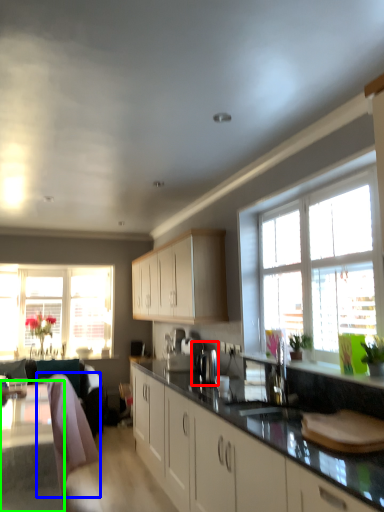
Question: Based on their relative distances, which object is nearer to coffee machine (highlighted by a red box)? Choose from swivel chair (highlighted by a blue box) and table (highlighted by a green box).

Choices:
 (A) swivel chair
 (B) table

Answer: (A)